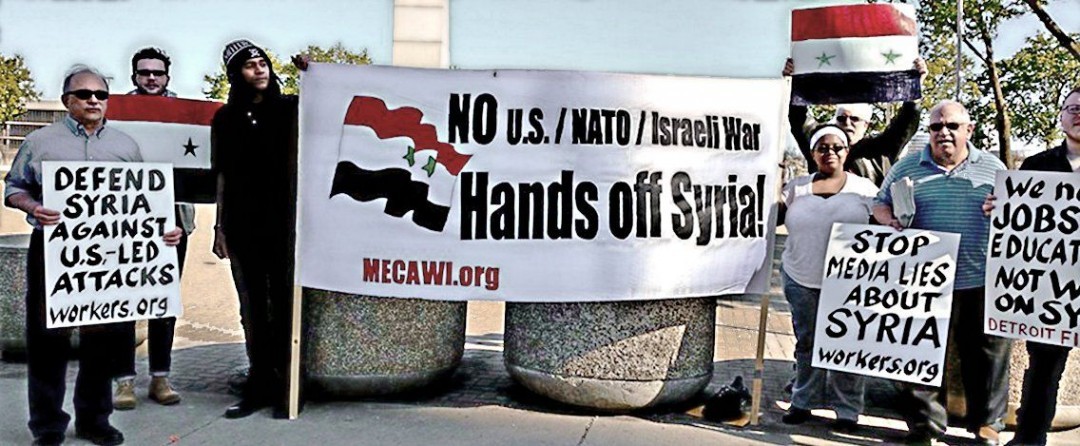
Identify the location of planter. Image resolution: width=1080 pixels, height=446 pixels. (324, 354), (589, 341), (1068, 393), (21, 268).